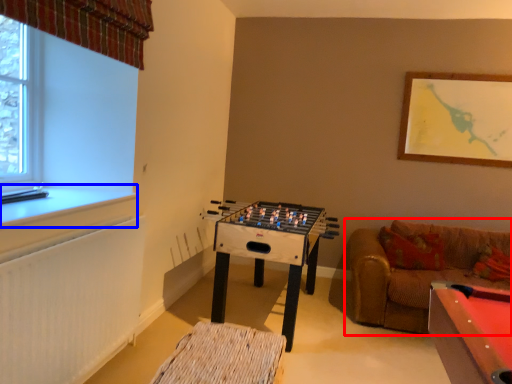
Question: Which object appears farthest to the camera in this image, studio couch (highlighted by a red box) or window sill (highlighted by a blue box)?

Choices:
 (A) studio couch
 (B) window sill

Answer: (A)